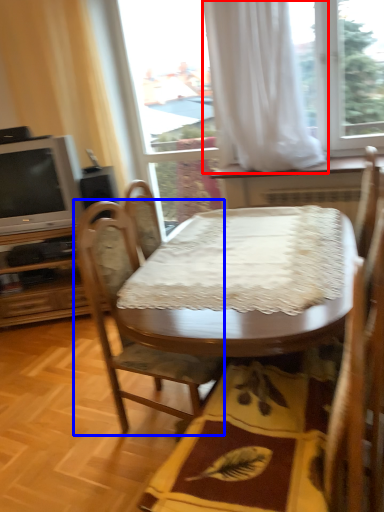
Question: Which object appears closest to the camera in this image, curtain (highlighted by a red box) or chair (highlighted by a blue box)?

Choices:
 (A) curtain
 (B) chair

Answer: (B)